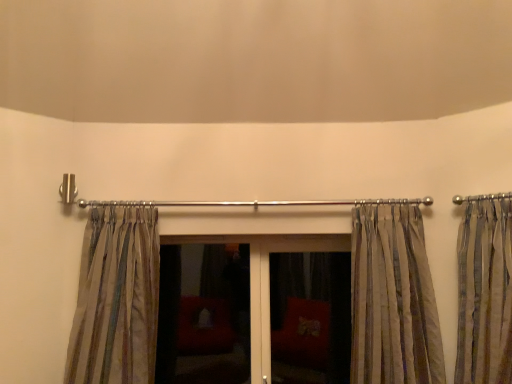
Question: From a real-world perspective, is matte glass door at center physically located above or below silky beige curtains at right, which is the first curtain from right to left?

Choices:
 (A) below
 (B) above

Answer: (A)

Question: In the image, is matte glass door at center positioned in front of or behind silky beige curtains at right, the 3th curtain viewed from the left?

Choices:
 (A) behind
 (B) front

Answer: (A)

Question: Which of these objects is positioned closest to the striped fabric curtain at center, which is the 2th curtain in left-to-right order?

Choices:
 (A) matte glass door at center
 (B) silky beige curtain at left, acting as the 3th curtain starting from the right
 (C) silky beige curtains at right, the 3th curtain viewed from the left
 (D) matte glass screen door at center, the 1th screen door in the right-to-left sequence
 (E) matte glass screen door at center, arranged as the first screen door when viewed from the left

Answer: (C)

Question: Which object is positioned closest to the matte glass screen door at center, the 1th screen door in the right-to-left sequence?

Choices:
 (A) matte glass screen door at center, marked as the second screen door in a right-to-left arrangement
 (B) striped fabric curtain at center, which is the 2th curtain in right-to-left order
 (C) silky beige curtains at right, which is the first curtain from right to left
 (D) matte glass door at center
 (E) silky beige curtain at left, acting as the 3th curtain starting from the right

Answer: (D)